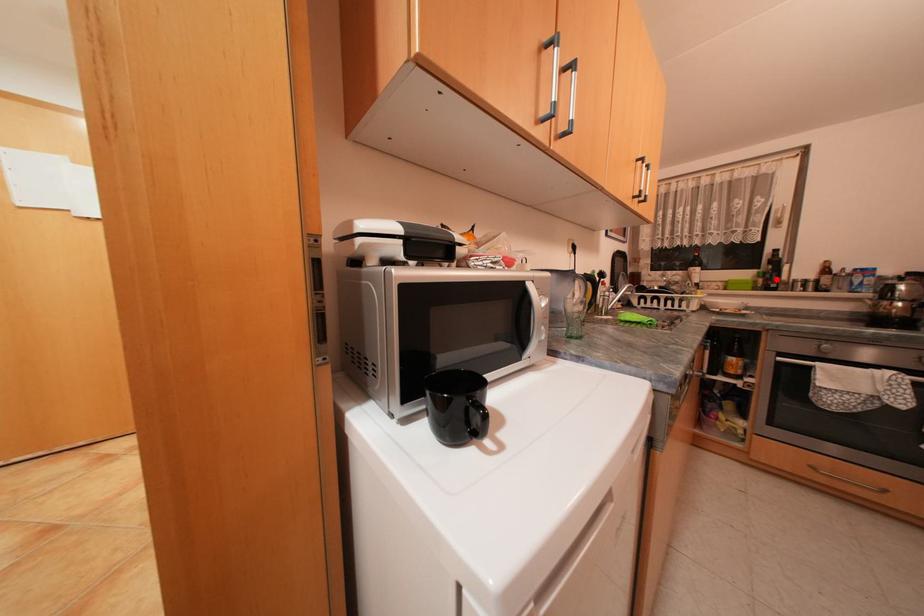
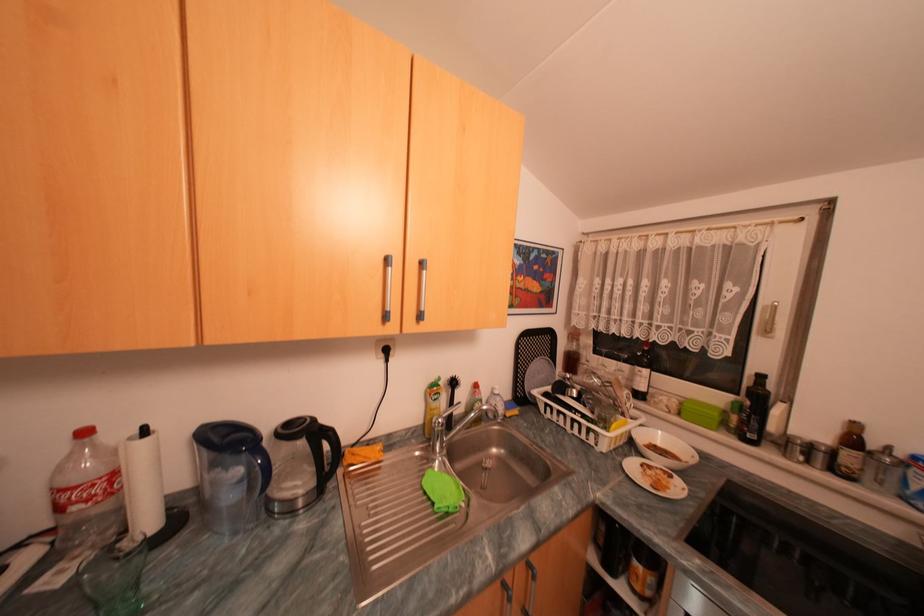
Where in the second image is the point corresponding to the highlighted location from the first image?

(752, 422)